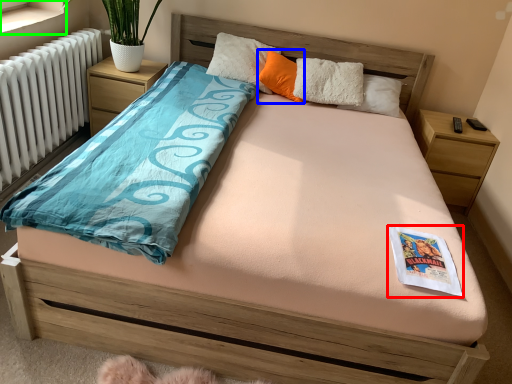
Question: Considering the real-world distances, which object is closest to magazine (highlighted by a red box)? pillow (highlighted by a blue box) or window sill (highlighted by a green box).

Choices:
 (A) pillow
 (B) window sill

Answer: (A)